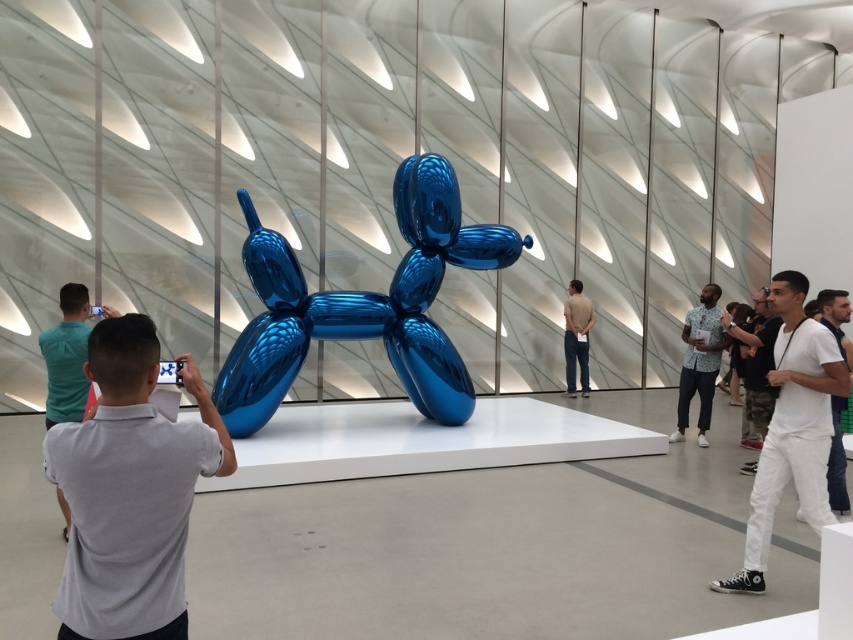
Question: Observing the image, what is the correct spatial positioning of white cotton pants at right in reference to floral shirt at right?

Choices:
 (A) right
 (B) left

Answer: (B)

Question: Among these objects, which one is farthest from the camera?

Choices:
 (A) gray shirt at center
 (B) white cotton shirt at right
 (C) light brown leather jacket at center

Answer: (C)

Question: Which object appears farthest from the camera in this image?

Choices:
 (A) white cotton pants at right
 (B) shiny blue balloon dog at center

Answer: (B)

Question: Is white cotton pants at right closer to the viewer compared to white matte shirt at right?

Choices:
 (A) no
 (B) yes

Answer: (B)

Question: Among these objects, which one is farthest from the camera?

Choices:
 (A) floral shirt at right
 (B) shiny blue balloon dog at center
 (C) white cotton shirt at right
 (D) light gray shirt at left

Answer: (A)

Question: Does shiny blue balloon dog at center appear over white cotton shirt at right?

Choices:
 (A) no
 (B) yes

Answer: (B)